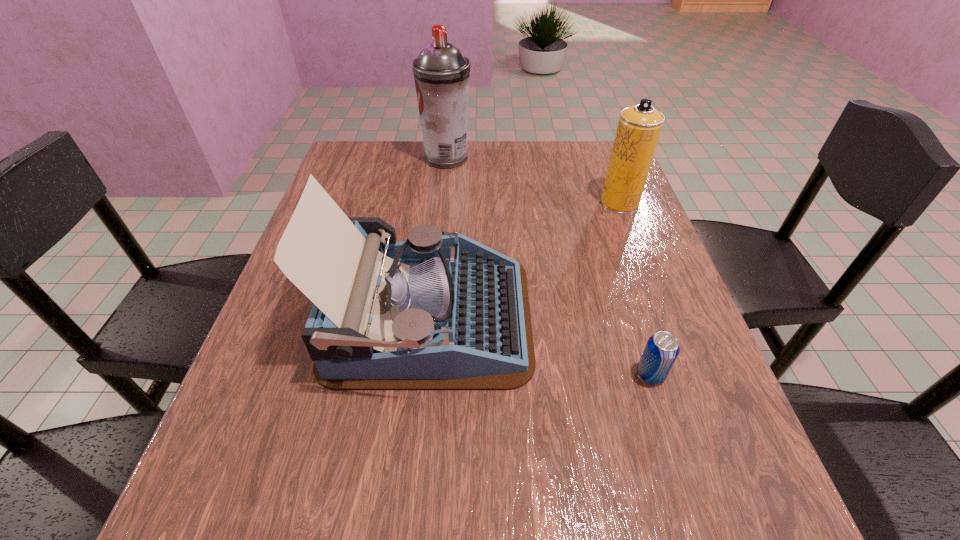
Where is `the left aerosol can`? the left aerosol can is located at coordinates (441, 73).

Identify the location of the tallest object. Image resolution: width=960 pixels, height=540 pixels. tap(441, 73).

Find the location of a particular element. The height and width of the screenshot is (540, 960). the right aerosol can is located at coordinates (639, 127).

Where is `the nearer aerosol can`? The height and width of the screenshot is (540, 960). the nearer aerosol can is located at coordinates (639, 127).

Locate an element on the screen. The image size is (960, 540). typewriter is located at coordinates (434, 312).

Find the location of `beer can`. beer can is located at coordinates (662, 349).

Image resolution: width=960 pixels, height=540 pixels. I want to click on free space located on the right of the taller aerosol can, so click(x=562, y=157).

You are a GUI agent. You are given a task and a screenshot of the screen. Output one action in this format:
    pyautogui.click(x=<x>, y=<y>)
    Task: Click on the vacant space located on the back of the second farthest object
    The width and height of the screenshot is (960, 540).
    Given the screenshot: What is the action you would take?
    pyautogui.click(x=604, y=160)

The height and width of the screenshot is (540, 960). Identify the location of free space located 0.300m on the typing side of the typewriter. (685, 318).

Image resolution: width=960 pixels, height=540 pixels. I want to click on free space located 0.360m on the left of the shortest object, so click(x=428, y=374).